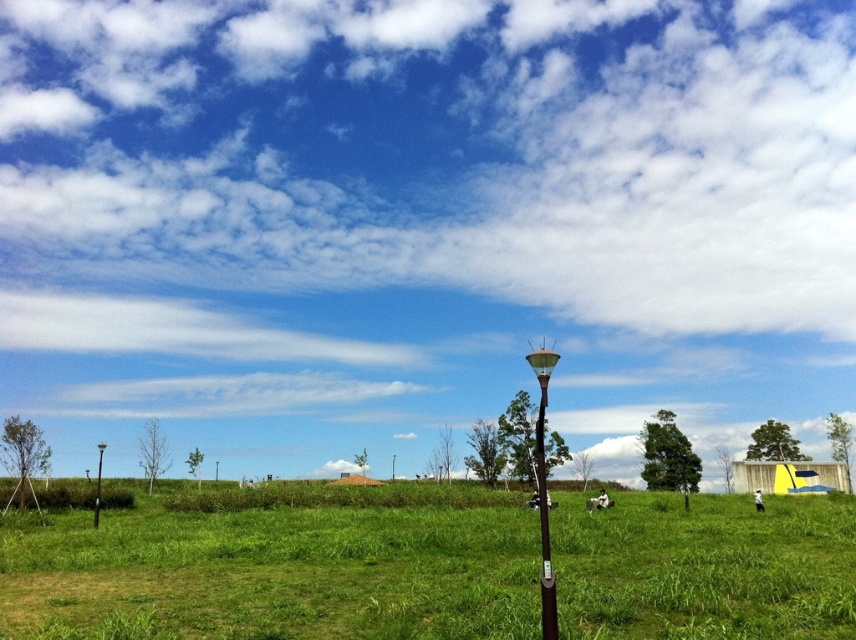
Question: Does green grass at center lie behind metallic gray pole at center?

Choices:
 (A) yes
 (B) no

Answer: (A)

Question: Does green grass at center appear over metallic gray pole at center?

Choices:
 (A) no
 (B) yes

Answer: (B)

Question: Does metallic gray pole at center have a greater width compared to metallic pole at left?

Choices:
 (A) yes
 (B) no

Answer: (B)

Question: Among these points, which one is nearest to the camera?

Choices:
 (A) (798, 611)
 (B) (545, 499)
 (C) (96, 484)

Answer: (A)

Question: Among these objects, which one is farthest from the camera?

Choices:
 (A) green grass at center
 (B) metallic gray pole at center
 (C) metallic pole at left

Answer: (C)

Question: Which object appears farthest from the camera in this image?

Choices:
 (A) metallic pole at left
 (B) green grass at center
 (C) metallic gray pole at center

Answer: (A)